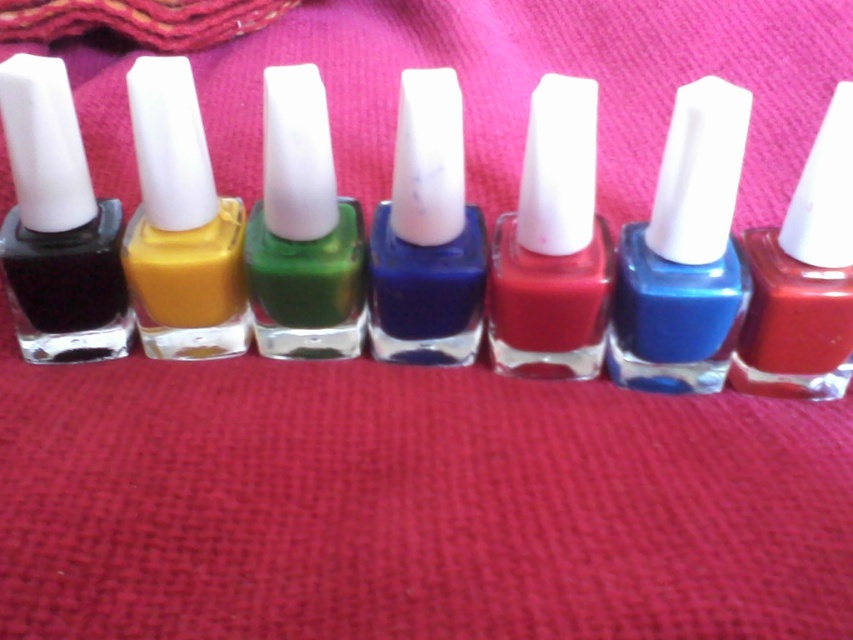
Based on the photo, you are organizing nail polish bottles on a shelf and need to place the matte yellow nail polish at center and the matte blue nail polish at center. According to the image, which one should be placed to the left of the other?

The matte yellow nail polish at center should be placed to the left of the matte blue nail polish at center because the description states that the matte yellow nail polish at center is to the left of the matte blue nail polish at center.

You are organizing nail polish bottles on a shelf. You have a matte black nail polish at left and a matte blue nail polish at center. Which bottle is taller?

The matte black nail polish at left is taller than the matte blue nail polish at center.